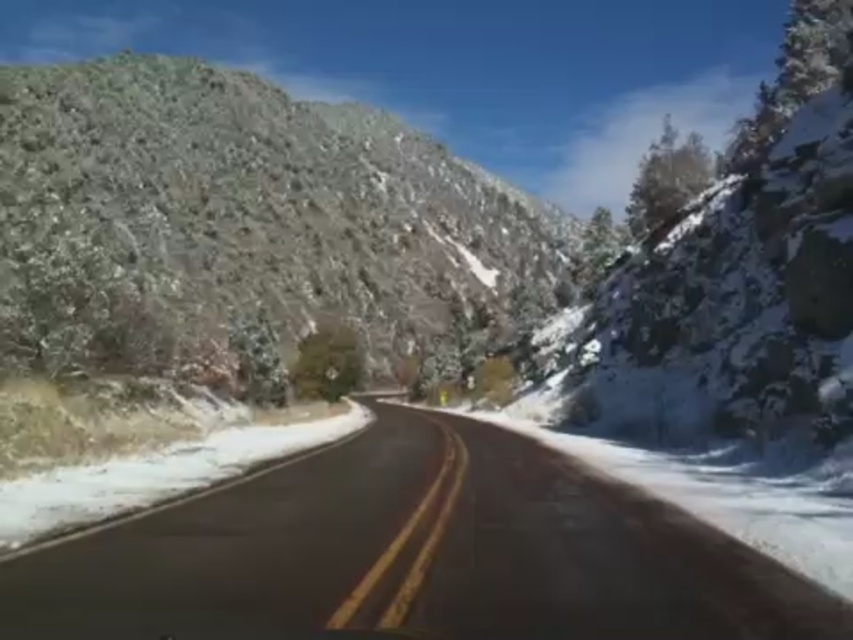
Which is in front, point (19, 234) or point (341, 636)?

Positioned in front is point (341, 636).

Describe the element at coordinates (242, 221) in the screenshot. I see `green rock at upper left` at that location.

This screenshot has width=853, height=640. In order to click on green rock at upper left in this screenshot , I will do `click(242, 221)`.